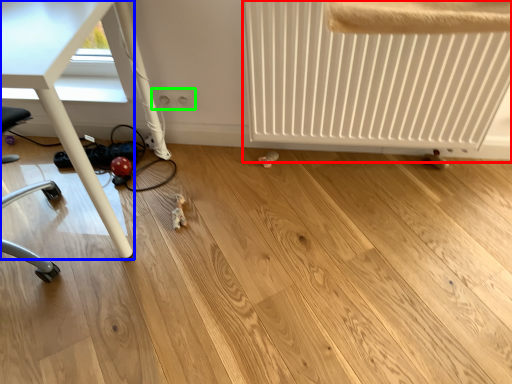
Question: Considering the real-world distances, which object is farthest from radiator (highlighted by a red box)? table (highlighted by a blue box) or electric outlet (highlighted by a green box)?

Choices:
 (A) table
 (B) electric outlet

Answer: (A)